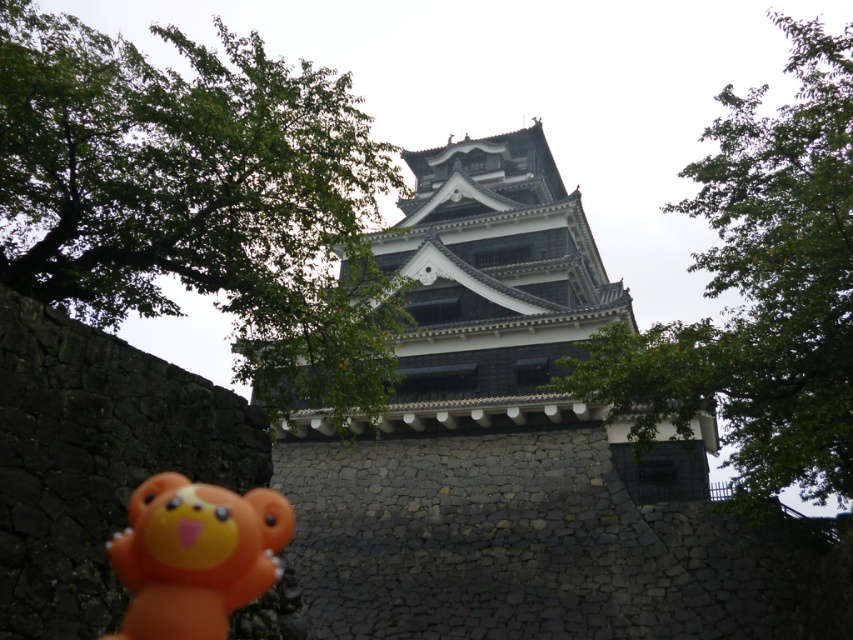
From the picture: Who is taller, green leafy tree at upper left or green leafy tree at upper right?

Standing taller between the two is green leafy tree at upper right.

Can you confirm if green leafy tree at upper left is positioned to the right of green leafy tree at upper right?

Incorrect, green leafy tree at upper left is not on the right side of green leafy tree at upper right.

The width and height of the screenshot is (853, 640). What are the coordinates of `green leafy tree at upper left` in the screenshot? It's located at (199, 198).

Is green leafy tree at upper left bigger than orange rubber bear at lower left?

Indeed, green leafy tree at upper left has a larger size compared to orange rubber bear at lower left.

This screenshot has width=853, height=640. Describe the element at coordinates (199, 198) in the screenshot. I see `green leafy tree at upper left` at that location.

Consider the image. Measure the distance between green leafy tree at upper left and camera.

The distance of green leafy tree at upper left from camera is 36.61 meters.

You are a GUI agent. You are given a task and a screenshot of the screen. Output one action in this format:
    pyautogui.click(x=<x>, y=<y>)
    Task: Click on the green leafy tree at upper left
    The image size is (853, 640).
    Given the screenshot: What is the action you would take?
    pyautogui.click(x=199, y=198)

Does green leafy tree at upper right have a lesser width compared to orange rubber bear at lower left?

No, green leafy tree at upper right is not thinner than orange rubber bear at lower left.

Is point (598, 397) behind point (190, 608)?

Yes, point (598, 397) is farther from viewer.

Is point (724, 230) more distant than point (190, 496)?

Yes.

You are a GUI agent. You are given a task and a screenshot of the screen. Output one action in this format:
    pyautogui.click(x=<x>, y=<y>)
    Task: Click on the green leafy tree at upper right
    The height and width of the screenshot is (640, 853).
    Given the screenshot: What is the action you would take?
    pyautogui.click(x=759, y=291)